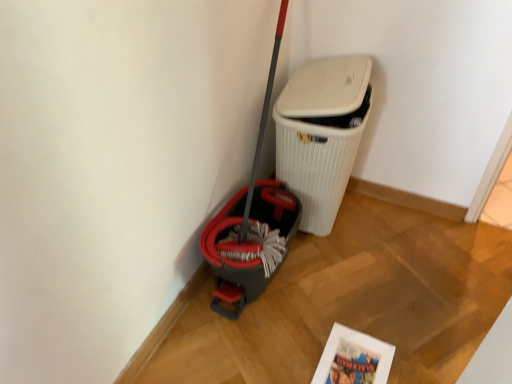
Where is `empty space that is ontop of matte white comic book at lower center (from a real-world perspective)`? empty space that is ontop of matte white comic book at lower center (from a real-world perspective) is located at coordinates (352, 361).